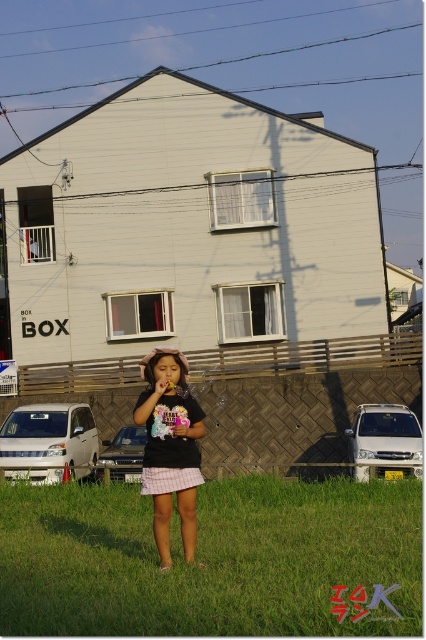
Can you confirm if green grass at center is wider than matte pink flower at center?

Yes, green grass at center is wider than matte pink flower at center.

Can you confirm if green grass at center is shorter than matte pink flower at center?

Correct, green grass at center is not as tall as matte pink flower at center.

Describe the element at coordinates (209, 560) in the screenshot. I see `green grass at center` at that location.

Image resolution: width=426 pixels, height=640 pixels. In order to click on green grass at center in this screenshot , I will do click(x=209, y=560).

Looking at this image, is green grass at center smaller than plaid cotton dress at center?

Indeed, green grass at center has a smaller size compared to plaid cotton dress at center.

Is green grass at center above plaid cotton dress at center?

No.

Who is more distant from viewer, (184, 580) or (155, 406)?

The point (155, 406) is behind.

This screenshot has width=426, height=640. Identify the location of green grass at center. (209, 560).

Between plaid cotton dress at center and matte pink flower at center, which one has less height?

Standing shorter between the two is matte pink flower at center.

Does point (157, 417) come behind point (184, 440)?

No, it is in front of (184, 440).

The image size is (426, 640). I want to click on plaid cotton dress at center, so click(170, 445).